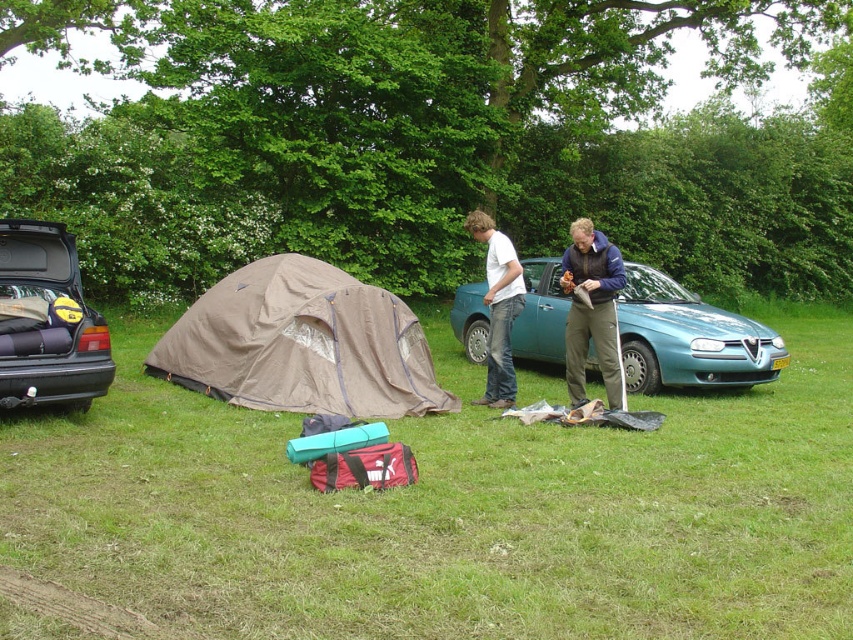
Question: Which of these objects is positioned farthest from the brown fabric tent at center?

Choices:
 (A) teal metallic car at center
 (B) white matte t-shirt at center
 (C) matte black car trunk at left

Answer: (A)

Question: Which of these objects is positioned farthest from the white matte t-shirt at center?

Choices:
 (A) blue fleece jacket at center
 (B) blue fabric tent at center
 (C) teal metallic car at center
 (D) brown fabric tent at center

Answer: (C)

Question: Can you confirm if teal metallic car at center is thinner than blue fabric tent at center?

Choices:
 (A) yes
 (B) no

Answer: (B)

Question: Among these objects, which one is nearest to the camera?

Choices:
 (A) white matte t-shirt at center
 (B) blue fabric tent at center
 (C) brown fabric tent at center

Answer: (C)

Question: Is teal metallic car at center in front of blue fleece jacket at center?

Choices:
 (A) yes
 (B) no

Answer: (B)

Question: Where is brown fabric tent at center located in relation to white matte t-shirt at center in the image?

Choices:
 (A) above
 (B) below

Answer: (B)